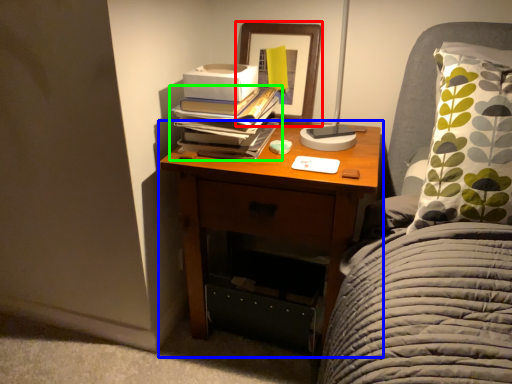
Question: Based on their relative distances, which object is farther from picture frame (highlighted by a red box)? Choose from nightstand (highlighted by a blue box) and book (highlighted by a green box).

Choices:
 (A) nightstand
 (B) book

Answer: (A)